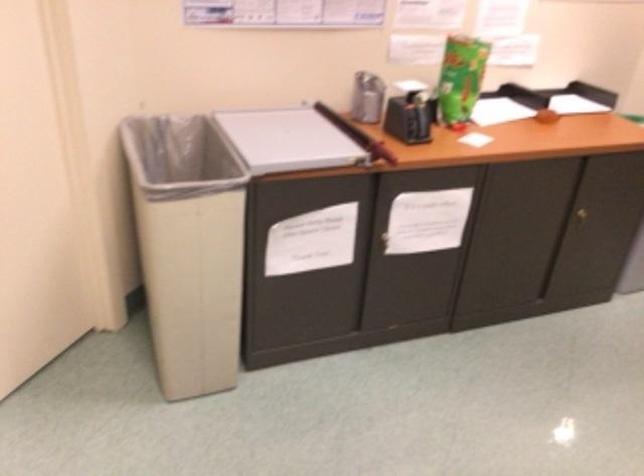
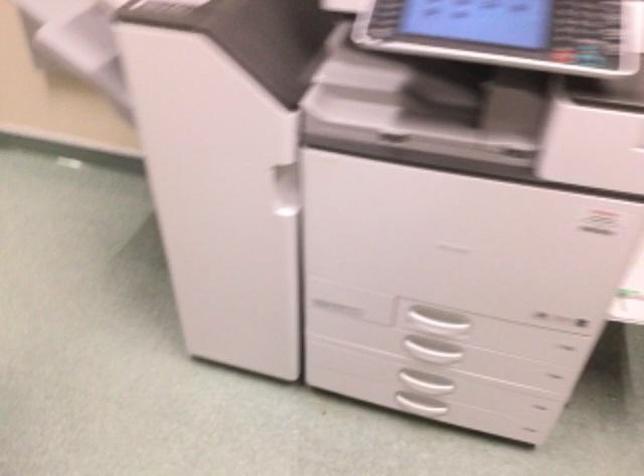
The images are taken continuously from a first-person perspective. In which direction is your viewpoint rotating?

The camera rotated toward right-down.